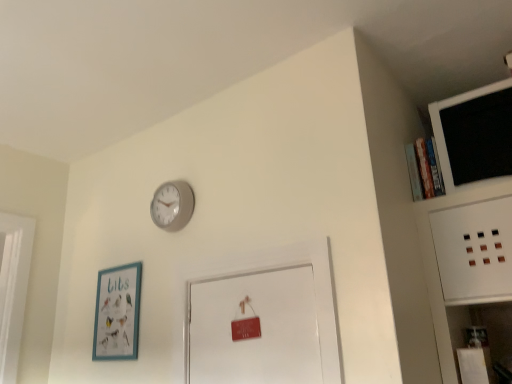
Question: From the image's perspective, is matte gray clock at upper center beneath teal matte picture frame at lower left?

Choices:
 (A) no
 (B) yes

Answer: (A)

Question: Does matte gray clock at upper center appear on the left side of teal matte picture frame at lower left?

Choices:
 (A) no
 (B) yes

Answer: (A)

Question: Is teal matte picture frame at lower left completely or partially inside matte gray clock at upper center?

Choices:
 (A) yes
 (B) no

Answer: (B)

Question: Is matte gray clock at upper center positioned behind teal matte picture frame at lower left?

Choices:
 (A) yes
 (B) no

Answer: (B)

Question: Is matte gray clock at upper center closer to the viewer compared to teal matte picture frame at lower left?

Choices:
 (A) no
 (B) yes

Answer: (B)

Question: Is matte gray clock at upper center to the left or to the right of teal matte picture frame at lower left in the image?

Choices:
 (A) right
 (B) left

Answer: (A)

Question: Looking at the image, does matte gray clock at upper center seem bigger or smaller compared to teal matte picture frame at lower left?

Choices:
 (A) small
 (B) big

Answer: (A)

Question: Looking at their shapes, would you say matte gray clock at upper center is wider or thinner than teal matte picture frame at lower left?

Choices:
 (A) thin
 (B) wide

Answer: (B)

Question: From the image's perspective, is matte gray clock at upper center located above or below teal matte picture frame at lower left?

Choices:
 (A) above
 (B) below

Answer: (A)

Question: Would you say teal matte picture frame at lower left is to the left or to the right of black matte computer monitor at upper right in the picture?

Choices:
 (A) right
 (B) left

Answer: (B)

Question: In terms of height, does teal matte picture frame at lower left look taller or shorter compared to black matte computer monitor at upper right?

Choices:
 (A) short
 (B) tall

Answer: (B)

Question: From a real-world perspective, is teal matte picture frame at lower left above or below black matte computer monitor at upper right?

Choices:
 (A) below
 (B) above

Answer: (A)

Question: Relative to black matte computer monitor at upper right, is teal matte picture frame at lower left in front or behind?

Choices:
 (A) behind
 (B) front

Answer: (A)

Question: Considering the positions of point (184, 188) and point (480, 132), is point (184, 188) closer or farther from the camera than point (480, 132)?

Choices:
 (A) closer
 (B) farther

Answer: (B)

Question: From the image's perspective, relative to black matte computer monitor at upper right, is matte gray clock at upper center above or below?

Choices:
 (A) below
 (B) above

Answer: (A)